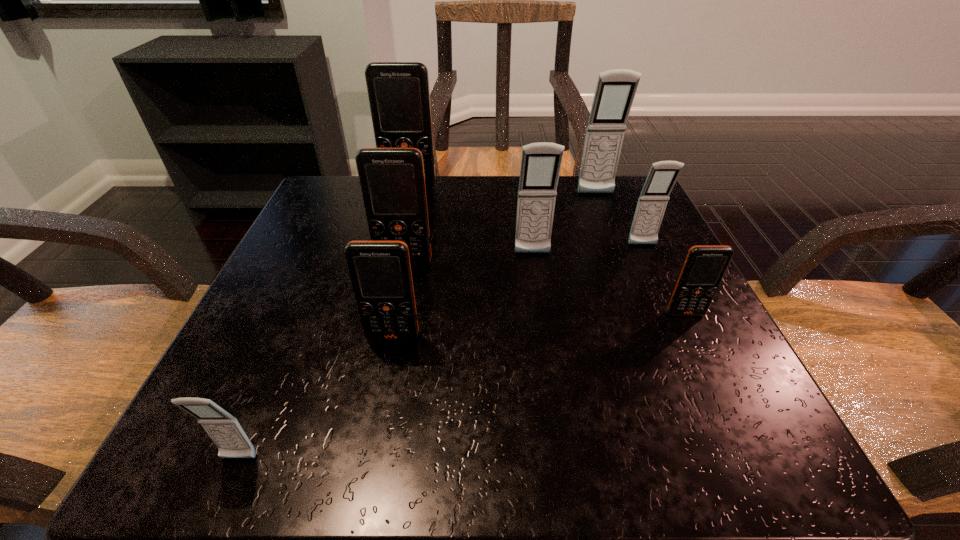
This screenshot has width=960, height=540. Identify the location of vacant point located on the screen of the third nearest cellular telephone. (712, 368).

Where is `object situated at the near edge`? The width and height of the screenshot is (960, 540). object situated at the near edge is located at coordinates (223, 428).

At what (x,y) coordinates should I click in order to perform the action: click on object that is at the far left corner. Please return your answer as a coordinate pair (x, y). The height and width of the screenshot is (540, 960). Looking at the image, I should click on (399, 97).

In order to click on object situated at the near left corner in this screenshot , I will do `click(223, 428)`.

Find the location of `object located at the far right corner`. object located at the far right corner is located at coordinates (615, 91).

Where is `vacant space at the far edge of the desktop`? Image resolution: width=960 pixels, height=540 pixels. vacant space at the far edge of the desktop is located at coordinates 496,210.

Locate an element on the screen. Image resolution: width=960 pixels, height=540 pixels. vacant region at the near edge is located at coordinates (474, 421).

You are a GUI agent. You are given a task and a screenshot of the screen. Output one action in this format:
    pyautogui.click(x=<x>, y=<y>)
    Task: Click on the free location at the left edge of the desktop
    The width and height of the screenshot is (960, 540).
    Given the screenshot: What is the action you would take?
    pyautogui.click(x=320, y=392)

Locate an element on the screen. vacant area at the right edge of the desktop is located at coordinates (676, 277).

The image size is (960, 540). Find the location of `vacant space at the far left corner of the desktop`. vacant space at the far left corner of the desktop is located at coordinates (x=310, y=222).